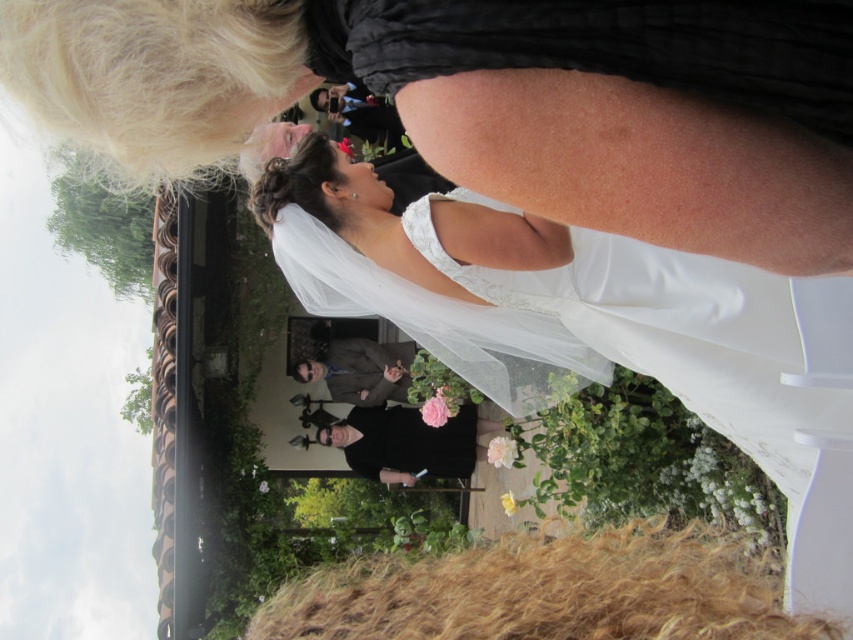
Image resolution: width=853 pixels, height=640 pixels. What do you see at coordinates (408, 442) in the screenshot?
I see `black satin suit at center` at bounding box center [408, 442].

Does point (355, 467) lie behind point (347, 380)?

No.

I want to click on black satin suit at center, so click(408, 442).

Does satin white dress at center appear over black satin suit at center?

Yes.

Who is more forward, (x=479, y=285) or (x=383, y=444)?

Point (x=479, y=285) is in front.

At what (x,y) coordinates should I click in order to perform the action: click on satin white dress at center. Please return your answer as a coordinate pair (x, y). This screenshot has height=640, width=853. Looking at the image, I should click on click(703, 358).

Can you confirm if satin white dress at center is wider than dark gray suit at center?

No.

In the scene shown: Measure the distance from satin white dress at center to dark gray suit at center.

19.03 meters

Does point (817, 368) come behind point (328, 390)?

That is False.

This screenshot has height=640, width=853. Find the location of `satin white dress at center`. satin white dress at center is located at coordinates (703, 358).